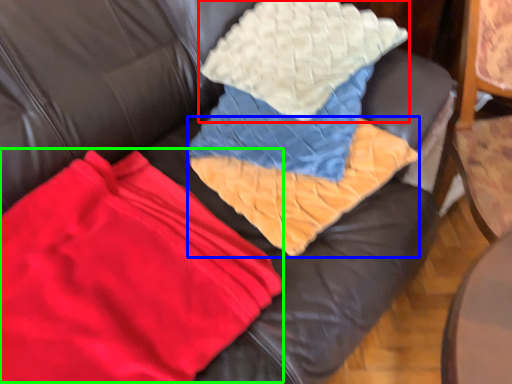
Question: Estimate the real-world distances between objects in this image. Which object is closer to throw pillow (highlighted by a red box), blanket (highlighted by a blue box) or fabric (highlighted by a green box)?

Choices:
 (A) blanket
 (B) fabric

Answer: (A)